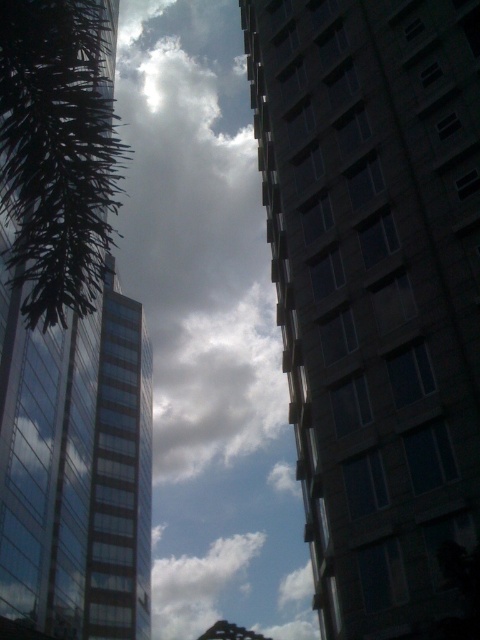
Question: Where is dark glass building at right located in relation to green leafy palm tree at left in the image?

Choices:
 (A) left
 (B) right

Answer: (B)

Question: Can you confirm if dark glass building at right is positioned to the right of glassy reflective tower at left?

Choices:
 (A) no
 (B) yes

Answer: (B)

Question: Which of these objects is positioned farthest from the dark glass building at right?

Choices:
 (A) glassy reflective tower at left
 (B) white fluffy cloud at center
 (C) green leafy palm tree at left

Answer: (B)

Question: Estimate the real-world distances between objects in this image. Which object is farther from the dark glass building at right?

Choices:
 (A) green leafy palm tree at left
 (B) glassy reflective tower at left

Answer: (B)

Question: In this image, where is green leafy palm tree at left located relative to white fluffy cloud at center?

Choices:
 (A) above
 (B) below

Answer: (A)

Question: Among these objects, which one is nearest to the camera?

Choices:
 (A) dark glass building at right
 (B) glassy reflective tower at left

Answer: (A)